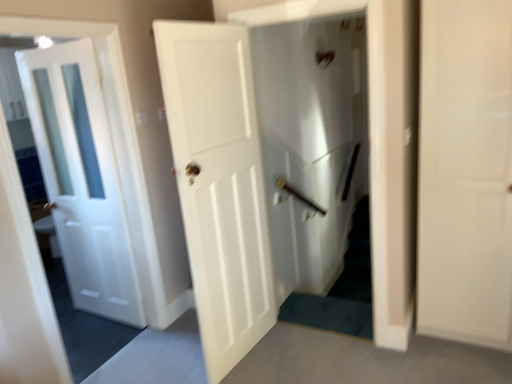
Question: Can we say white matte door at center, which is the first door from right to left, lies outside white glossy door at center?

Choices:
 (A) no
 (B) yes

Answer: (B)

Question: Does white matte door at center, which is the first door from right to left, have a greater height compared to white glossy door at center?

Choices:
 (A) no
 (B) yes

Answer: (A)

Question: From the image's perspective, is white matte door at center, which is the second door in left-to-right order, over white glossy door at center?

Choices:
 (A) no
 (B) yes

Answer: (A)

Question: Can white glossy door at center be found inside white matte door at center, which is the first door from right to left?

Choices:
 (A) no
 (B) yes

Answer: (A)

Question: From a real-world perspective, is white matte door at center, which is the first door from right to left, physically above white glossy door at center?

Choices:
 (A) yes
 (B) no

Answer: (B)

Question: From a real-world perspective, is white glossy door at left, the second door from the right, physically located above or below white glossy door at center?

Choices:
 (A) below
 (B) above

Answer: (B)

Question: Considering the positions of white glossy door at left, marked as the 1th door in a left-to-right arrangement, and white glossy door at center in the image, is white glossy door at left, marked as the 1th door in a left-to-right arrangement, bigger or smaller than white glossy door at center?

Choices:
 (A) small
 (B) big

Answer: (B)

Question: Is white glossy door at left, marked as the 1th door in a left-to-right arrangement, taller or shorter than white glossy door at center?

Choices:
 (A) tall
 (B) short

Answer: (B)

Question: Considering the relative positions of white glossy door at left, marked as the 1th door in a left-to-right arrangement, and white glossy door at center in the image provided, is white glossy door at left, marked as the 1th door in a left-to-right arrangement, to the left or to the right of white glossy door at center?

Choices:
 (A) left
 (B) right

Answer: (A)

Question: Is white glossy door at center in front of or behind white glossy door at left, marked as the 1th door in a left-to-right arrangement, in the image?

Choices:
 (A) front
 (B) behind

Answer: (B)

Question: Is point (285, 218) positioned closer to the camera than point (79, 248)?

Choices:
 (A) closer
 (B) farther

Answer: (B)

Question: From a real-world perspective, is white glossy door at center above or below white glossy door at left, the second door from the right?

Choices:
 (A) above
 (B) below

Answer: (B)

Question: In terms of height, does white glossy door at center look taller or shorter compared to white glossy door at left, marked as the 1th door in a left-to-right arrangement?

Choices:
 (A) short
 (B) tall

Answer: (B)

Question: Looking at the image, does white matte door at center, which is the second door in left-to-right order, seem bigger or smaller compared to white glossy door at center?

Choices:
 (A) small
 (B) big

Answer: (B)

Question: Does point (225, 256) appear closer or farther from the camera than point (352, 46)?

Choices:
 (A) closer
 (B) farther

Answer: (A)